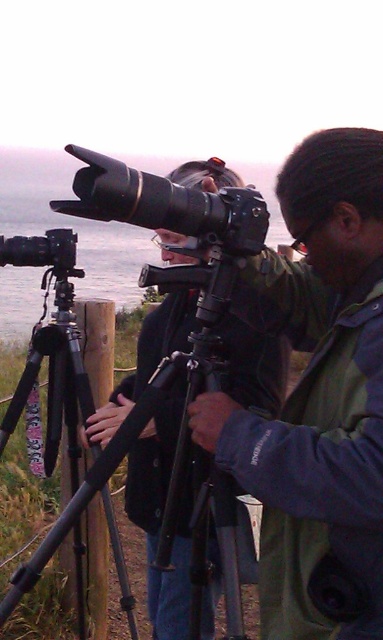
Question: Which point is farther from the camera taking this photo?

Choices:
 (A) (24, 264)
 (B) (60, 349)

Answer: (B)

Question: Considering the real-world distances, which object is farthest from the black matte tripod at left?

Choices:
 (A) matte black camera at center
 (B) matte black camera at left

Answer: (A)

Question: Which of the following is the farthest from the observer?

Choices:
 (A) (16, 257)
 (B) (224, 241)

Answer: (A)

Question: Does black matte tripod at left have a larger size compared to matte black camera at left?

Choices:
 (A) yes
 (B) no

Answer: (A)

Question: Observing the image, what is the correct spatial positioning of black matte tripod at left in reference to matte black camera at left?

Choices:
 (A) above
 (B) below

Answer: (B)

Question: Considering the relative positions of matte black camera at center and matte black camera at left in the image provided, where is matte black camera at center located with respect to matte black camera at left?

Choices:
 (A) left
 (B) right

Answer: (B)